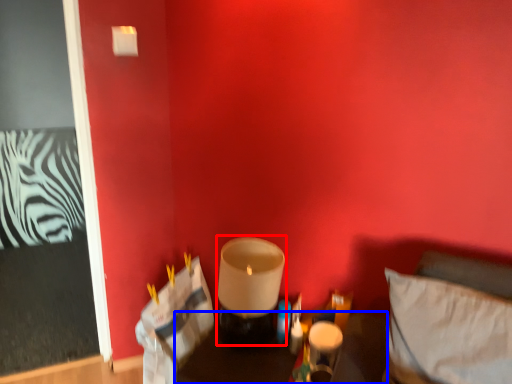
Question: Which object appears farthest to the camera in this image, candle holder (highlighted by a red box) or furniture (highlighted by a blue box)?

Choices:
 (A) candle holder
 (B) furniture

Answer: (A)